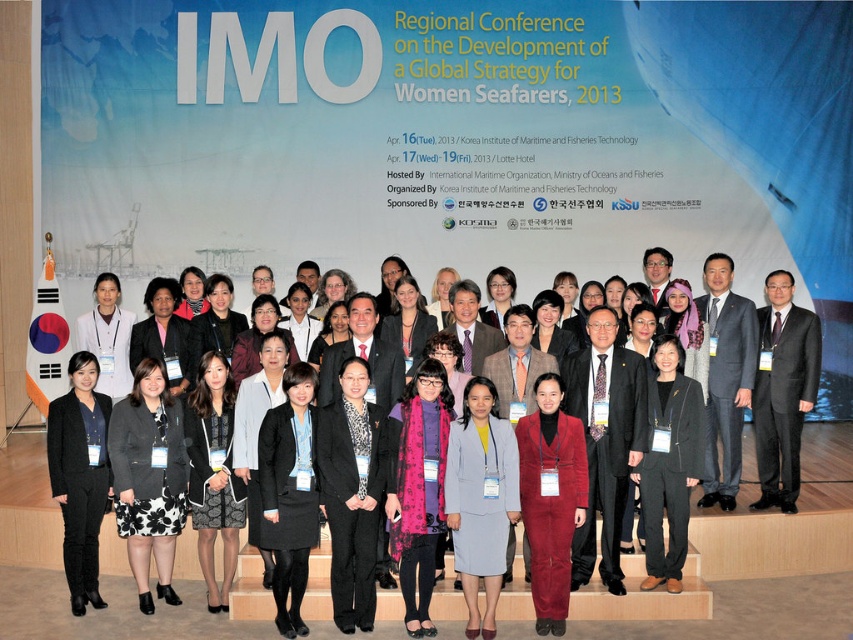
Is point (375, 483) farther from camera compared to point (711, 492)?

That is False.

Image resolution: width=853 pixels, height=640 pixels. What are the coordinates of `black textured suit at center` in the screenshot? It's located at (352, 493).

Who is more distant from viewer, (340, 538) or (726, 260)?

Point (726, 260)

Locate an element on the screen. This screenshot has height=640, width=853. black textured suit at center is located at coordinates pyautogui.click(x=352, y=493).

Does black floral dress at lower left have a greater height compared to black textured suit at center?

Correct, black floral dress at lower left is much taller as black textured suit at center.

Which is below, black floral dress at lower left or black textured suit at center?

black textured suit at center is lower down.

Is point (161, 364) farther from camera compared to point (340, 490)?

Yes, it is.

The image size is (853, 640). I want to click on black floral dress at lower left, so click(149, 477).

Does matte black suit at center have a smaller size compared to black fabric pants at center?

Actually, matte black suit at center might be larger than black fabric pants at center.

Can you confirm if matte black suit at center is positioned above black fabric pants at center?

Indeed, matte black suit at center is positioned over black fabric pants at center.

Is point (723, 572) closer to viewer compared to point (672, 468)?

That is False.

Locate an element on the screen. The height and width of the screenshot is (640, 853). matte black suit at center is located at coordinates (692, 572).